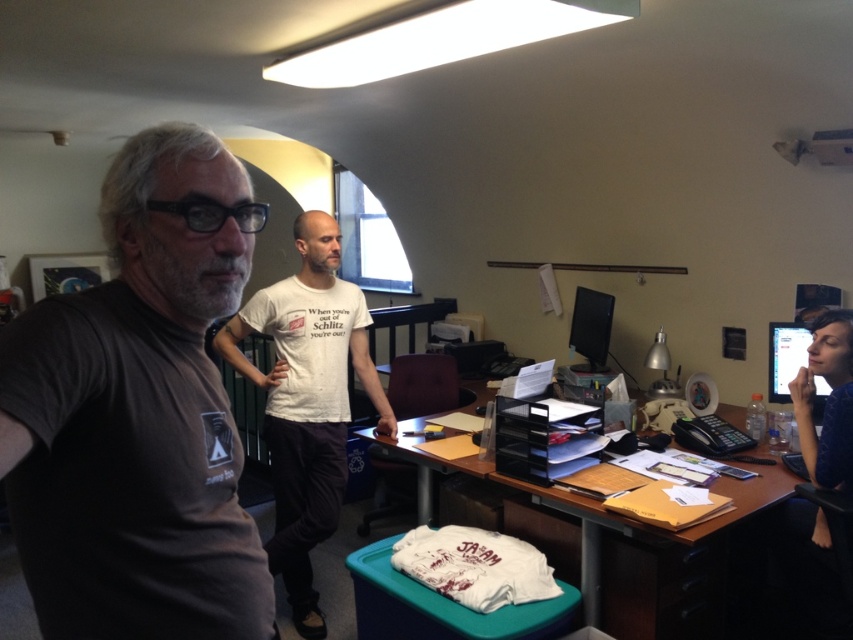
Can you confirm if matte black monitor at right is taller than matte black monitor at upper right?

Incorrect, matte black monitor at right's height is not larger of matte black monitor at upper right's.

At what (x,y) coordinates should I click in order to perform the action: click on matte black monitor at right. Please return your answer as a coordinate pair (x, y). Looking at the image, I should click on (785, 356).

Which is behind, point (770, 396) or point (602, 337)?

Positioned behind is point (602, 337).

The image size is (853, 640). Identify the location of matte black monitor at right. (785, 356).

Does white cotton t-shirt at center have a larger size compared to matte black monitor at upper right?

Indeed, white cotton t-shirt at center has a larger size compared to matte black monitor at upper right.

Can you confirm if white cotton t-shirt at center is positioned to the left of matte black monitor at upper right?

Yes, white cotton t-shirt at center is to the left of matte black monitor at upper right.

Find the location of `white cotton t-shirt at center`. white cotton t-shirt at center is located at coordinates (306, 401).

Is point (296, 380) positioned after point (827, 317)?

Yes, it is.

In the scene shown: Who is higher up, white cotton t-shirt at center or blue fabric shirt at lower right?

Positioned higher is blue fabric shirt at lower right.

Who is more distant from viewer, [293,236] or [828,480]?

The point [293,236] is behind.

The height and width of the screenshot is (640, 853). What are the coordinates of `white cotton t-shirt at center` in the screenshot? It's located at (306, 401).